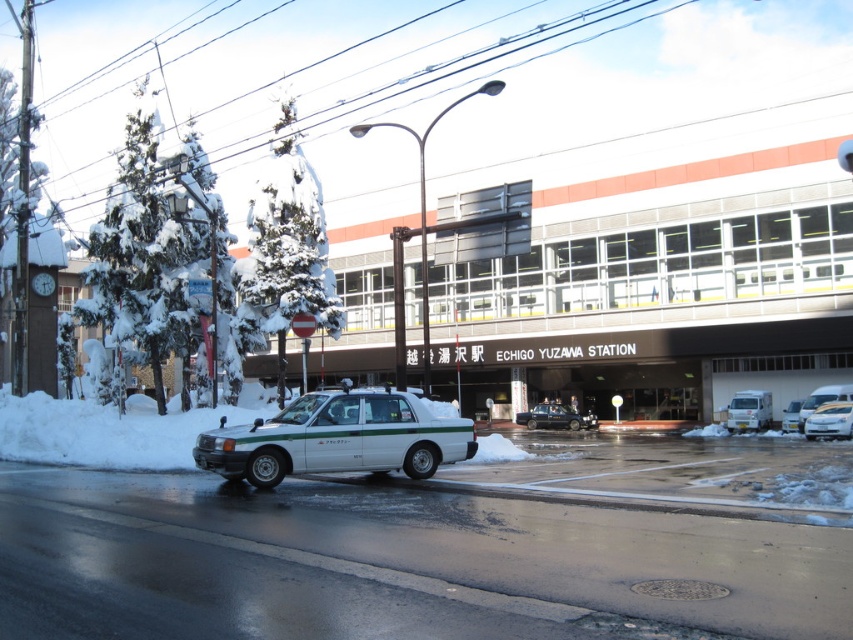
Question: Does white matte taxi at center have a larger size compared to white matte sedan at center?

Choices:
 (A) yes
 (B) no

Answer: (A)

Question: Estimate the real-world distances between objects in this image. Which object is closer to the white matte van at center-right?

Choices:
 (A) shiny black sedan at center
 (B) white glossy sedan at center
 (C) white matte sedan at center
 (D) white matte taxi at center

Answer: (C)

Question: Does white matte van at center-right appear over shiny black sedan at center?

Choices:
 (A) yes
 (B) no

Answer: (A)

Question: Which object appears closest to the camera in this image?

Choices:
 (A) white matte taxi at center
 (B) white matte van at center-right
 (C) shiny black sedan at center
 (D) white glossy sedan at center

Answer: (A)

Question: Which point is farther to the camera?

Choices:
 (A) white matte taxi at center
 (B) white glossy sedan at center

Answer: (B)

Question: Does shiny black sedan at center have a lesser width compared to white matte sedan at center?

Choices:
 (A) no
 (B) yes

Answer: (A)